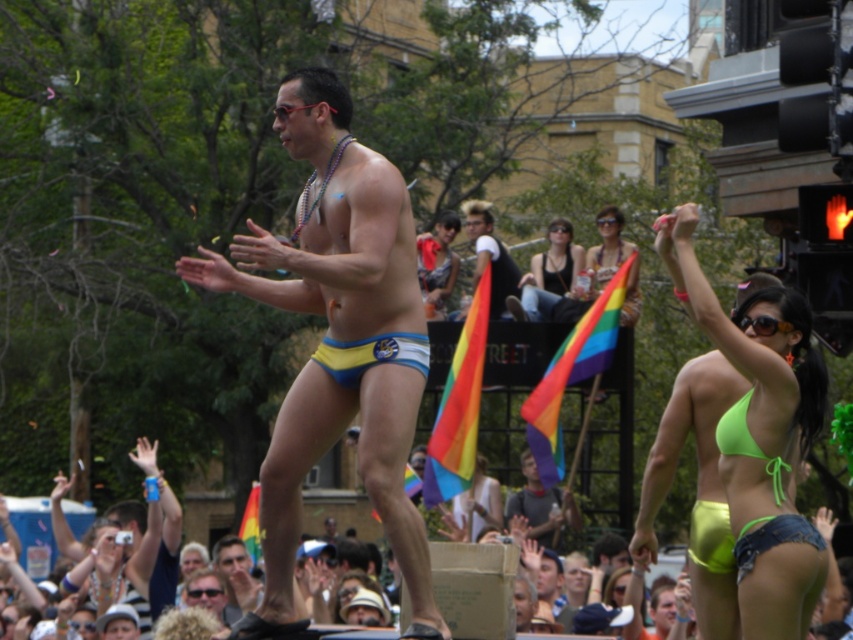
You are a photographer at the event and want to capture a photo of the neon green bikini top at upper right without the green fabric crowd at lower center blocking it. Can you adjust your position to achieve this?

The neon green bikini top at upper right is closer to the viewer than the green fabric crowd at lower center, so by moving your position closer to the performer or adjusting the angle, you can capture the neon green bikini top at upper right without the green fabric crowd at lower center blocking it.

You are a photographer trying to capture the neon green bikini top at upper right and the green fabric crowd at lower center in a single shot. Which object should you focus on first to ensure both are in frame?

→ You should focus on the neon green bikini top at upper right first because it is positioned to the right of the green fabric crowd at lower center, so adjusting the camera to include both from the right side would be more effective.